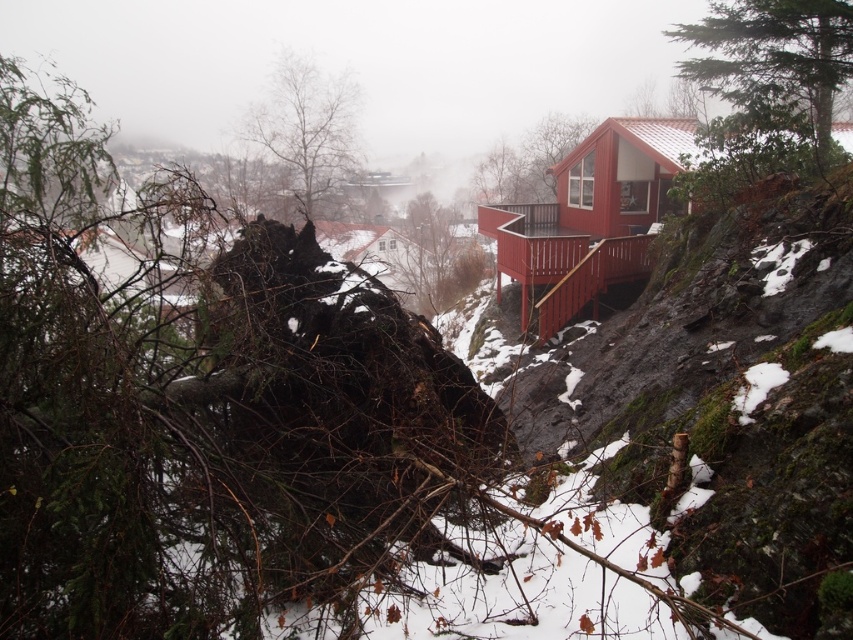
Is matte red cabin at center wider than white wooden cabin at center?

Yes, matte red cabin at center is wider than white wooden cabin at center.

This screenshot has height=640, width=853. I want to click on matte red cabin at center, so click(x=590, y=218).

Between point (834, 12) and point (334, 100), which one is positioned in front?

Positioned in front is point (834, 12).

Can you confirm if green textured tree at upper right is wider than smooth bark tree at upper center?

Indeed, green textured tree at upper right has a greater width compared to smooth bark tree at upper center.

Is point (712, 44) more distant than point (248, 116)?

That is False.

The height and width of the screenshot is (640, 853). Identify the location of green textured tree at upper right. (773, 54).

Can you confirm if white wooden cabin at center is positioned to the left of brown wood tree at upper center?

Correct, you'll find white wooden cabin at center to the left of brown wood tree at upper center.

Can you confirm if white wooden cabin at center is positioned to the right of brown wood tree at upper center?

In fact, white wooden cabin at center is to the left of brown wood tree at upper center.

Where is `white wooden cabin at center`? This screenshot has height=640, width=853. white wooden cabin at center is located at coordinates (381, 257).